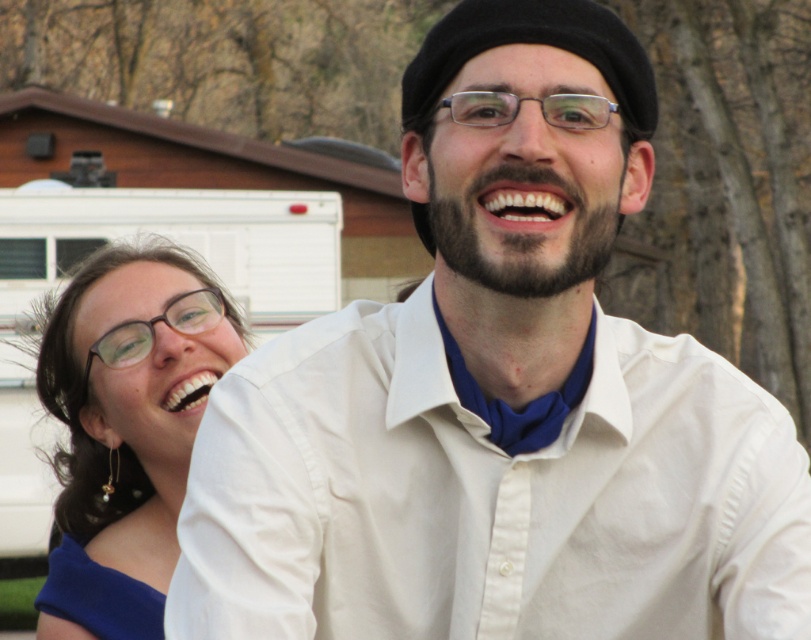
Question: Which object appears farthest from the camera in this image?

Choices:
 (A) blue fabric dress at lower left
 (B) blue fabric dress at left

Answer: (A)

Question: Which object appears farthest from the camera in this image?

Choices:
 (A) clear plastic glasses at center
 (B) blue fabric dress at left

Answer: (B)

Question: Which is nearer to the clear plastic glasses at center?

Choices:
 (A) blue fabric dress at lower left
 (B) blue fabric dress at left

Answer: (A)

Question: Does blue fabric dress at lower left lie behind clear plastic glasses at center?

Choices:
 (A) no
 (B) yes

Answer: (B)

Question: Does blue fabric dress at left have a lesser width compared to blue fabric dress at lower left?

Choices:
 (A) yes
 (B) no

Answer: (B)

Question: Observing the image, what is the correct spatial positioning of blue fabric dress at left in reference to clear plastic glasses at center?

Choices:
 (A) above
 (B) below

Answer: (B)